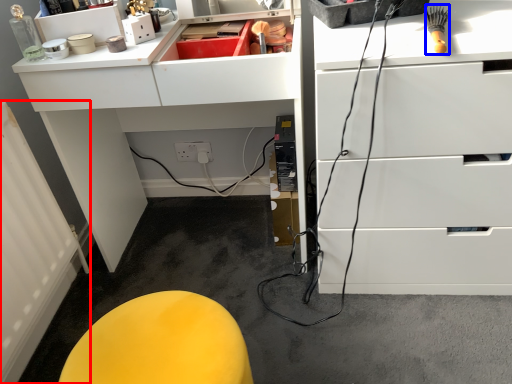
Question: Among these objects, which one is farthest to the camera, radiator (highlighted by a red box) or brush (highlighted by a blue box)?

Choices:
 (A) radiator
 (B) brush

Answer: (A)